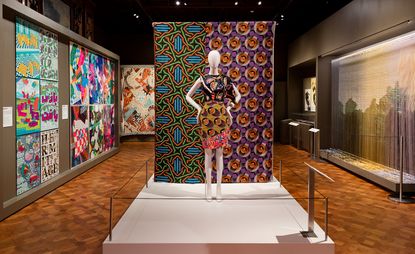
This screenshot has height=254, width=415. I want to click on ceiling lights, so click(x=133, y=12), click(x=179, y=1), click(x=230, y=9), click(x=235, y=3), click(x=257, y=2).